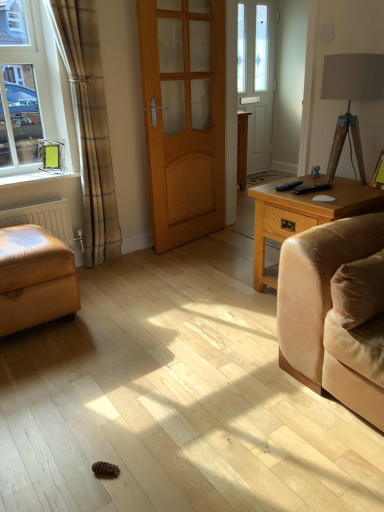
I want to click on free point in front of wooden door at center, so click(200, 261).